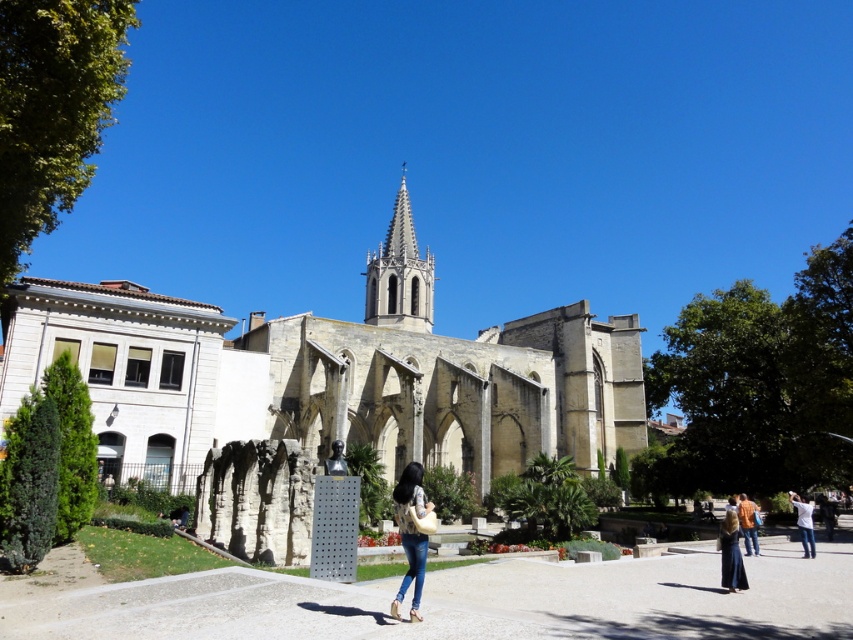
Between yellowish stone church at center and white cotton shirt at lower right, which one has less height?

white cotton shirt at lower right

This screenshot has width=853, height=640. What do you see at coordinates (331, 376) in the screenshot?
I see `yellowish stone church at center` at bounding box center [331, 376].

Find the location of a particular element. yellowish stone church at center is located at coordinates (331, 376).

Does yellowish stone church at center have a lesser width compared to smooth stone spire at center?

Incorrect, yellowish stone church at center's width is not less than smooth stone spire at center's.

Does yellowish stone church at center appear on the left side of smooth stone spire at center?

Incorrect, yellowish stone church at center is not on the left side of smooth stone spire at center.

Identify the location of yellowish stone church at center. (331, 376).

Looking at this image, is yellowish stone church at center wider than denim jeans at center?

Indeed, yellowish stone church at center has a greater width compared to denim jeans at center.

Is point (349, 413) closer to viewer compared to point (421, 513)?

No, it is behind (421, 513).

What do you see at coordinates (331, 376) in the screenshot? The width and height of the screenshot is (853, 640). I see `yellowish stone church at center` at bounding box center [331, 376].

Locate an element on the screen. Image resolution: width=853 pixels, height=640 pixels. yellowish stone church at center is located at coordinates (331, 376).